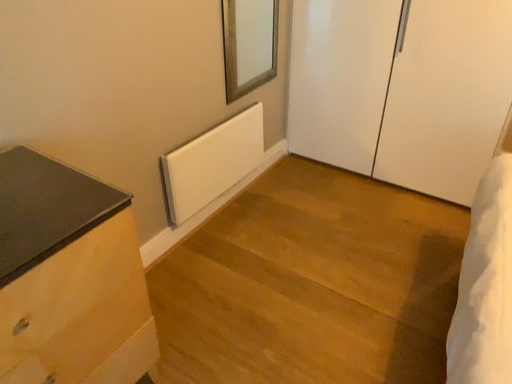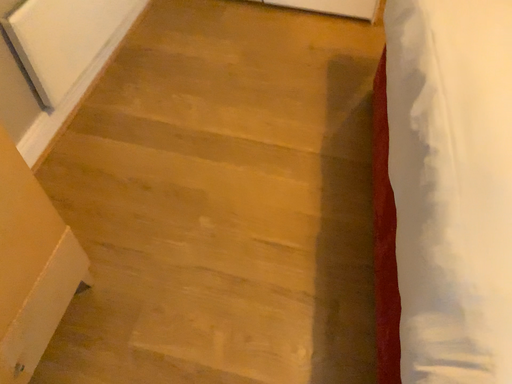
Question: Which way did the camera rotate in the video?

Choices:
 (A) rotated left
 (B) rotated right

Answer: (B)